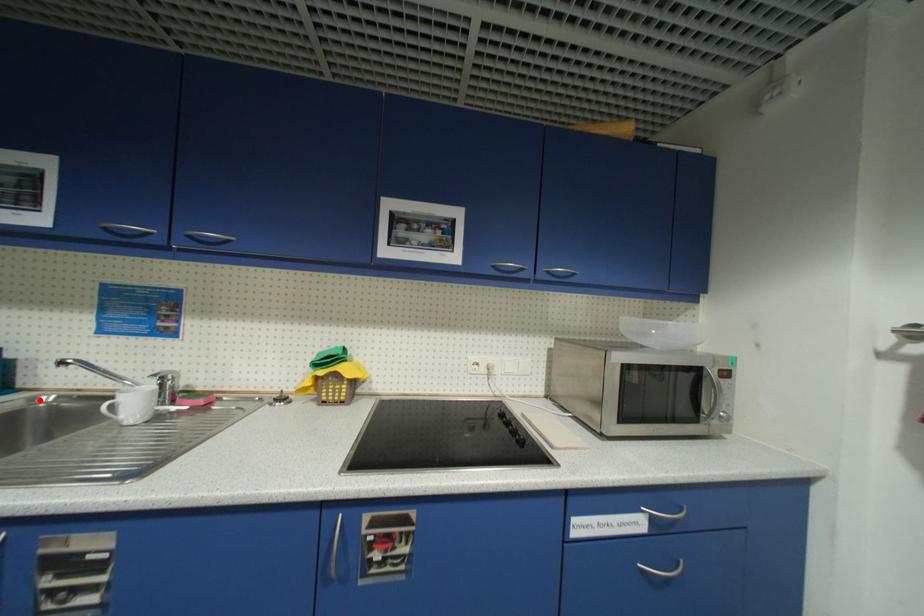
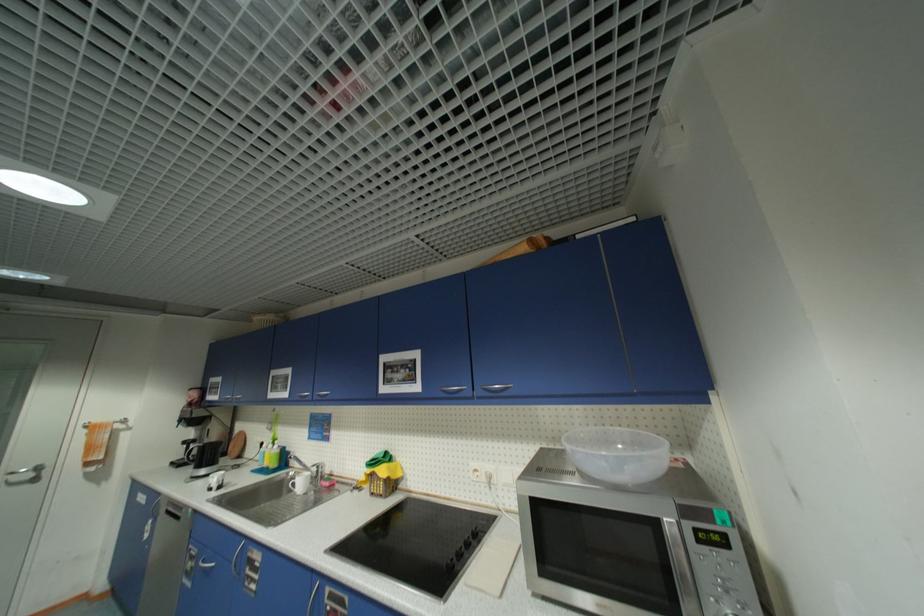
Locate, in the second image, the point that corresponds to the highlighted location in the first image.

(294, 475)